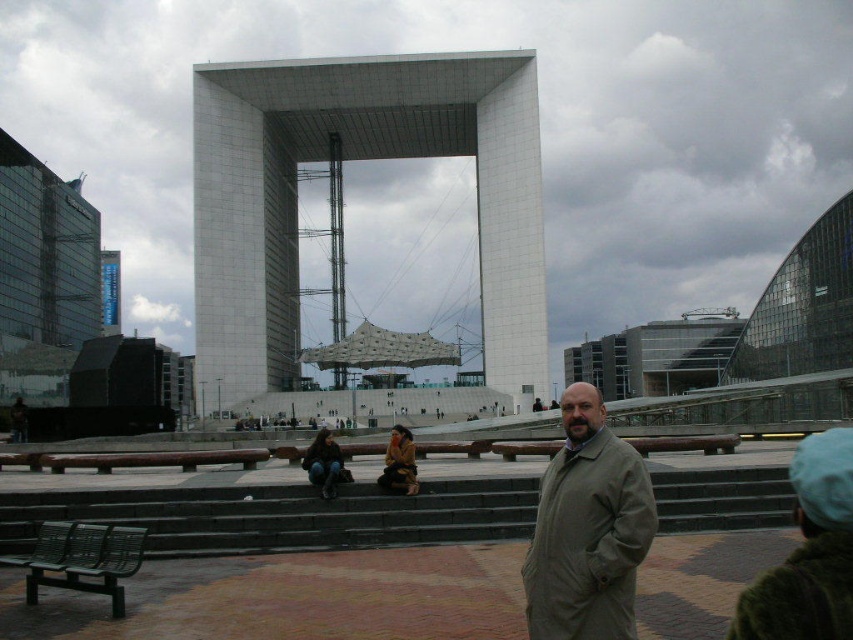
You are standing at the entrance of the plaza and want to take a photo of the white concrete structure at center and the denim jacket at lower center. Which object should you frame first in your camera viewfinder to ensure both are in the shot?

You should frame the denim jacket at lower center first because the white concrete structure at center is to the right of it, so positioning the denim jacket at lower center first will allow the structure to naturally come into view to its right side.

You are a city planner assessing the plaza layout. The white concrete structure at center and the tan fabric coat at center are both in the central area. Based on their sizes, which one would likely require more space for maintenance access around it?

The white concrete structure at center is much taller than the tan fabric coat at center, so it would likely require more space for maintenance access around it.

You are a delivery person trying to place a package on the dark gray concrete stairs at center. The package is as tall as the brown leather jacket at center. Will the package fit on the stairs?

The dark gray concrete stairs at center is shorter than the brown leather jacket at center. Since the package is as tall as the jacket, it will not fit on the stairs because the stairs are shorter than the package.